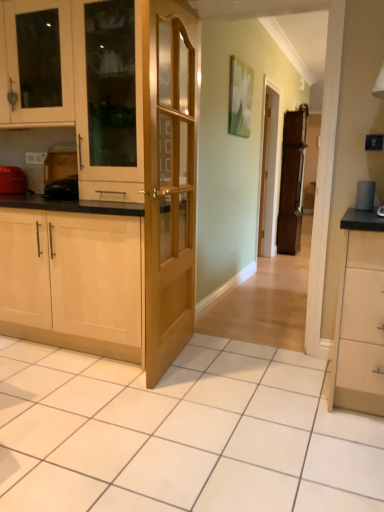
Question: In which direction should I rotate to look at matte wood cabinet at center, marked as the 2th cabinetry in a top-to-bottom arrangement?

Choices:
 (A) right
 (B) left

Answer: (B)

Question: Is matte wood cabinet at center, marked as the 2th cabinetry in a top-to-bottom arrangement, at the left side of matte red toaster at left?

Choices:
 (A) no
 (B) yes

Answer: (A)

Question: From a real-world perspective, does matte wood cabinet at center, which is the 2th cabinetry from bottom to top, sit lower than matte red toaster at left?

Choices:
 (A) no
 (B) yes

Answer: (A)

Question: Is matte wood cabinet at center, which is the 2th cabinetry from bottom to top, shorter than matte red toaster at left?

Choices:
 (A) yes
 (B) no

Answer: (B)

Question: Can you confirm if matte wood cabinet at center, which is the 2th cabinetry from bottom to top, is bigger than matte red toaster at left?

Choices:
 (A) yes
 (B) no

Answer: (A)

Question: Could you tell me if matte wood cabinet at center, marked as the 2th cabinetry in a top-to-bottom arrangement, is facing matte red toaster at left?

Choices:
 (A) no
 (B) yes

Answer: (A)

Question: From the image's perspective, does matte wood cabinet at center, marked as the 2th cabinetry in a top-to-bottom arrangement, appear higher than matte red toaster at left?

Choices:
 (A) yes
 (B) no

Answer: (A)

Question: Considering the relative sizes of matte red toaster at left and matte wooden screen door at center in the image provided, is matte red toaster at left smaller than matte wooden screen door at center?

Choices:
 (A) no
 (B) yes

Answer: (B)

Question: Can you confirm if matte red toaster at left is wider than matte wooden screen door at center?

Choices:
 (A) no
 (B) yes

Answer: (B)

Question: Considering the relative positions of matte red toaster at left and matte wooden screen door at center in the image provided, is matte red toaster at left to the right of matte wooden screen door at center from the viewer's perspective?

Choices:
 (A) no
 (B) yes

Answer: (A)

Question: Can you confirm if matte red toaster at left is thinner than matte wooden screen door at center?

Choices:
 (A) yes
 (B) no

Answer: (B)

Question: From a real-world perspective, is matte red toaster at left physically below matte wooden screen door at center?

Choices:
 (A) yes
 (B) no

Answer: (A)

Question: Is matte red toaster at left bigger than matte wooden screen door at center?

Choices:
 (A) no
 (B) yes

Answer: (A)

Question: Is light wood/glass door at center positioned with its back to matte wooden screen door at center?

Choices:
 (A) yes
 (B) no

Answer: (B)